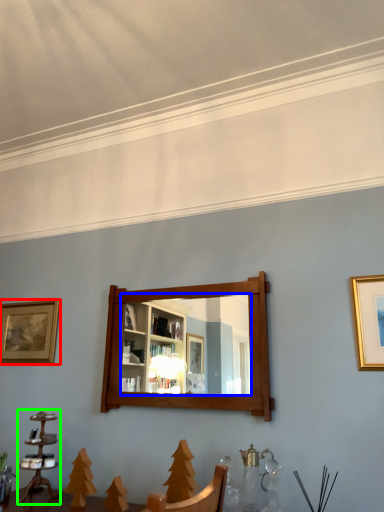
Question: Based on their relative distances, which object is nearer to picture frame (highlighted by a red box)? Choose from mirror (highlighted by a blue box) and candle holder (highlighted by a green box).

Choices:
 (A) mirror
 (B) candle holder

Answer: (B)